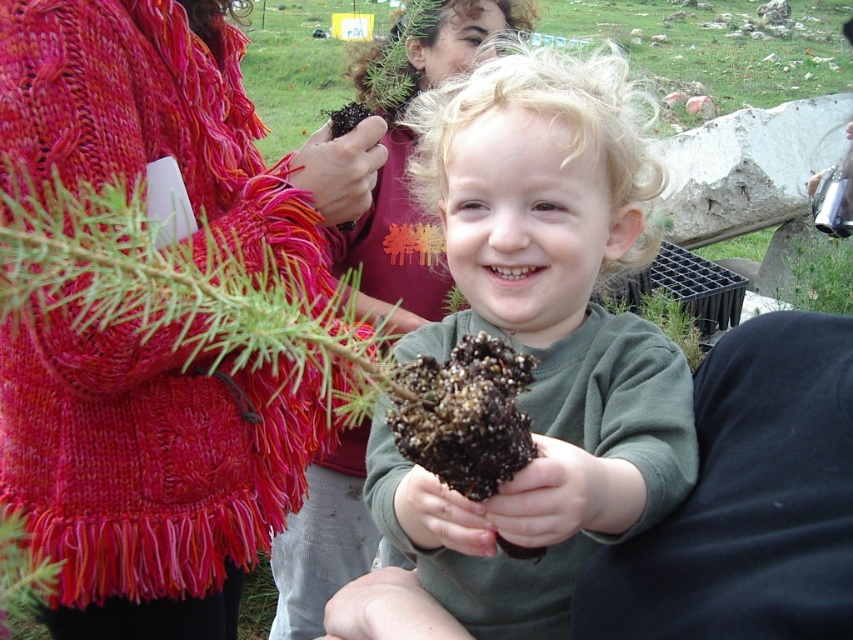
What do you see at coordinates (148, 474) in the screenshot? I see `knitted wool sweater at upper left` at bounding box center [148, 474].

This screenshot has height=640, width=853. I want to click on knitted wool sweater at upper left, so click(x=148, y=474).

From the picture: Can you confirm if knitted wool sweater at upper left is positioned below matte red sweater at center?

Indeed, knitted wool sweater at upper left is positioned under matte red sweater at center.

Which is behind, point (70, 456) or point (480, 3)?

Positioned behind is point (480, 3).

This screenshot has height=640, width=853. Identify the location of knitted wool sweater at upper left. (148, 474).

Is matte green sweater at center shorter than matte red sweater at center?

Indeed, matte green sweater at center has a lesser height compared to matte red sweater at center.

Is matte green sweater at center bigger than matte red sweater at center?

Yes, matte green sweater at center is bigger than matte red sweater at center.

Is point (556, 116) positioned behind point (399, 16)?

No, (556, 116) is in front of (399, 16).

This screenshot has height=640, width=853. Find the location of `matte green sweater at center`. matte green sweater at center is located at coordinates (540, 337).